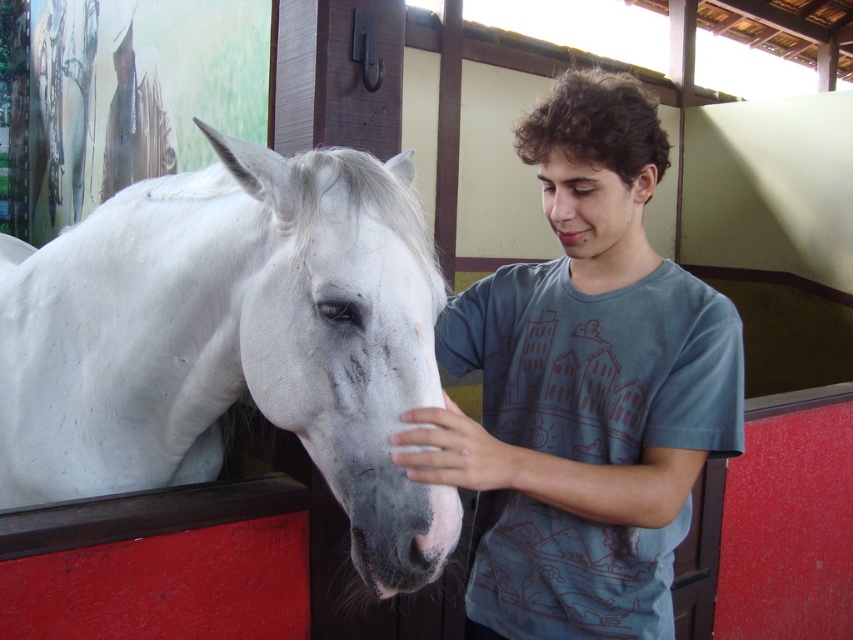
Does white matte horse at left come in front of matte skin nose at center?

Yes.

Is white matte horse at left wider than matte skin nose at center?

Correct, the width of white matte horse at left exceeds that of matte skin nose at center.

Find the location of a particular element. This screenshot has height=640, width=853. white matte horse at left is located at coordinates (231, 340).

The image size is (853, 640). Find the location of `white matte horse at left`. white matte horse at left is located at coordinates (231, 340).

Who is taller, matte blue shirt at center or matte skin nose at center?

With more height is matte blue shirt at center.

From the picture: Is matte blue shirt at center in front of matte skin nose at center?

That is True.

Is point (621, 269) positioned behind point (548, 180)?

Yes, it is.

Identify the location of matte blue shirt at center. This screenshot has height=640, width=853. (584, 392).

Does white matte horse at left have a lesser height compared to matte blue shirt at center?

Correct, white matte horse at left is not as tall as matte blue shirt at center.

Between white matte horse at left and matte blue shirt at center, which one has more height?

Standing taller between the two is matte blue shirt at center.

I want to click on white matte horse at left, so click(231, 340).